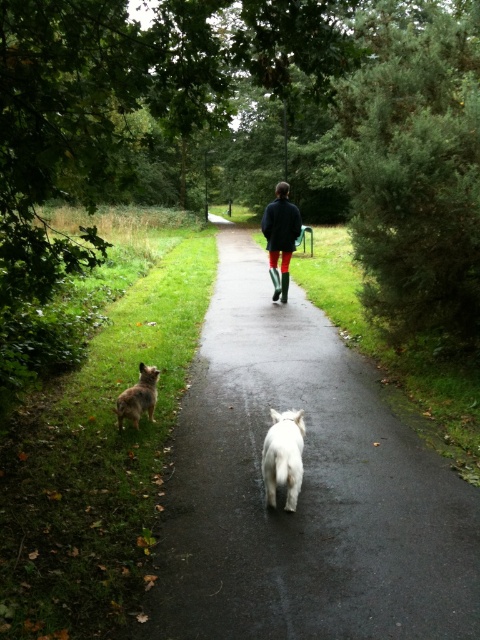
What do you see at coordinates (303, 488) in the screenshot? This screenshot has height=640, width=480. I see `dark asphalt path at center` at bounding box center [303, 488].

Is point (186, 452) closer to viewer compared to point (271, 493)?

No.

You are a GUI agent. You are given a task and a screenshot of the screen. Output one action in this format:
    pyautogui.click(x=<x>, y=<y>)
    Task: Click on the dark asphalt path at center
    
    Given the screenshot: What is the action you would take?
    pyautogui.click(x=303, y=488)

Between dark asphalt path at center and dark blue jacket at center, which one appears on the left side from the viewer's perspective?

From the viewer's perspective, dark asphalt path at center appears more on the left side.

Which is in front, point (204, 326) or point (269, 275)?

Point (204, 326)

Which is behind, point (238, 547) or point (267, 204)?

Point (267, 204)

Find the location of `dark asphalt path at center`. dark asphalt path at center is located at coordinates (303, 488).

Is point (265, 228) positioned after point (144, 372)?

Yes.

This screenshot has height=640, width=480. What are the coordinates of `dark blue jacket at center` in the screenshot? It's located at (280, 237).